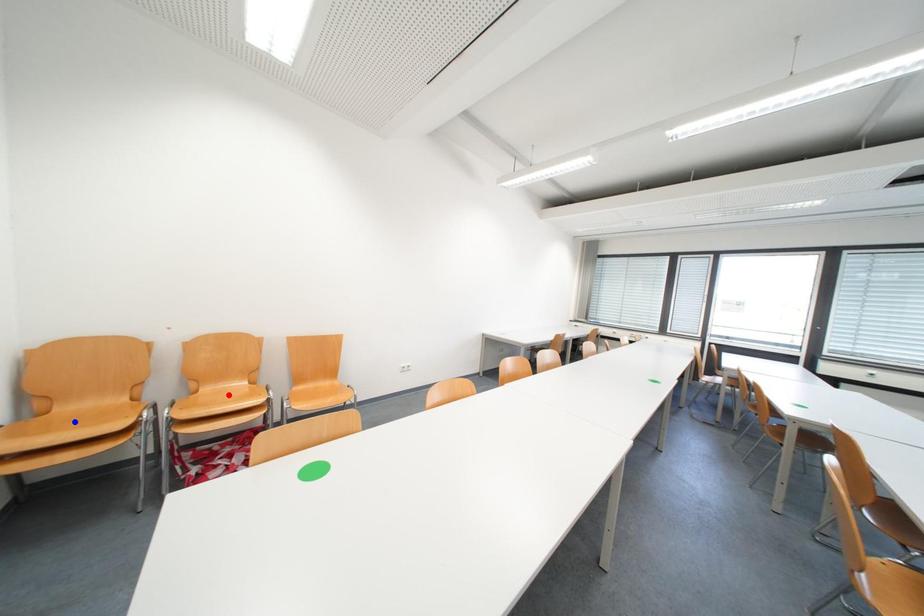
Question: In the image, two points are highlighted. Which point is nearer to the camera? Reply with the corresponding letter.

Choices:
 (A) blue point
 (B) red point

Answer: (A)